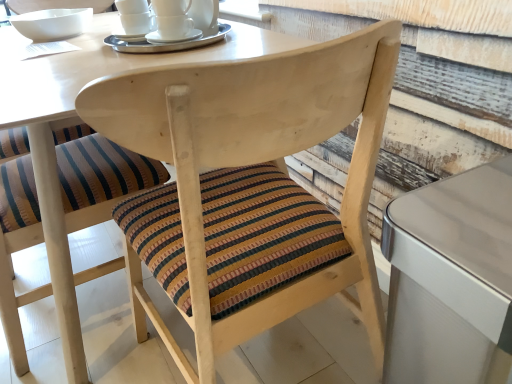
Question: Is metallic silver table at right wider than white ceramic bowl at upper left?

Choices:
 (A) no
 (B) yes

Answer: (B)

Question: Is metallic silver table at right not inside white ceramic bowl at upper left?

Choices:
 (A) no
 (B) yes

Answer: (B)

Question: Is metallic silver table at right bigger than white ceramic bowl at upper left?

Choices:
 (A) yes
 (B) no

Answer: (A)

Question: From a real-world perspective, is metallic silver table at right positioned under white ceramic bowl at upper left based on gravity?

Choices:
 (A) yes
 (B) no

Answer: (A)

Question: Is metallic silver table at right aimed at white ceramic bowl at upper left?

Choices:
 (A) yes
 (B) no

Answer: (B)

Question: Can you confirm if metallic silver table at right is positioned to the left of white ceramic bowl at upper left?

Choices:
 (A) no
 (B) yes

Answer: (A)

Question: Can you confirm if white ceramic cups at upper center is positioned to the right of metallic silver table at right?

Choices:
 (A) no
 (B) yes

Answer: (A)

Question: Can you confirm if white ceramic cups at upper center is taller than metallic silver table at right?

Choices:
 (A) no
 (B) yes

Answer: (A)

Question: Is white ceramic cups at upper center touching metallic silver table at right?

Choices:
 (A) yes
 (B) no

Answer: (B)

Question: Can you confirm if white ceramic cups at upper center is positioned to the left of metallic silver table at right?

Choices:
 (A) no
 (B) yes

Answer: (B)

Question: From the image's perspective, is white ceramic cups at upper center under metallic silver table at right?

Choices:
 (A) yes
 (B) no

Answer: (B)

Question: From the image's perspective, is white ceramic cups at upper center on metallic silver table at right?

Choices:
 (A) no
 (B) yes

Answer: (B)

Question: Can you confirm if striped fabric cushion at center, the first chair positioned from the left, is shorter than white ceramic cups at upper center?

Choices:
 (A) yes
 (B) no

Answer: (B)